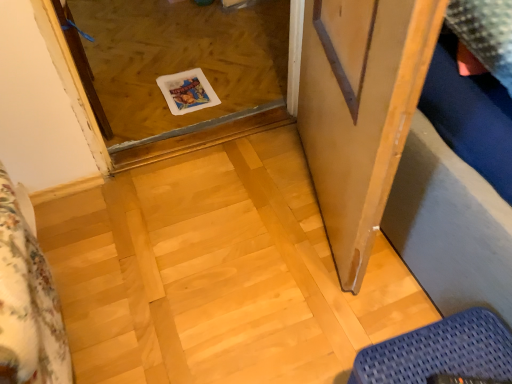
Identify the location of blank space situated above blue woven mat at lower right (from a real-world perspective). (439, 351).